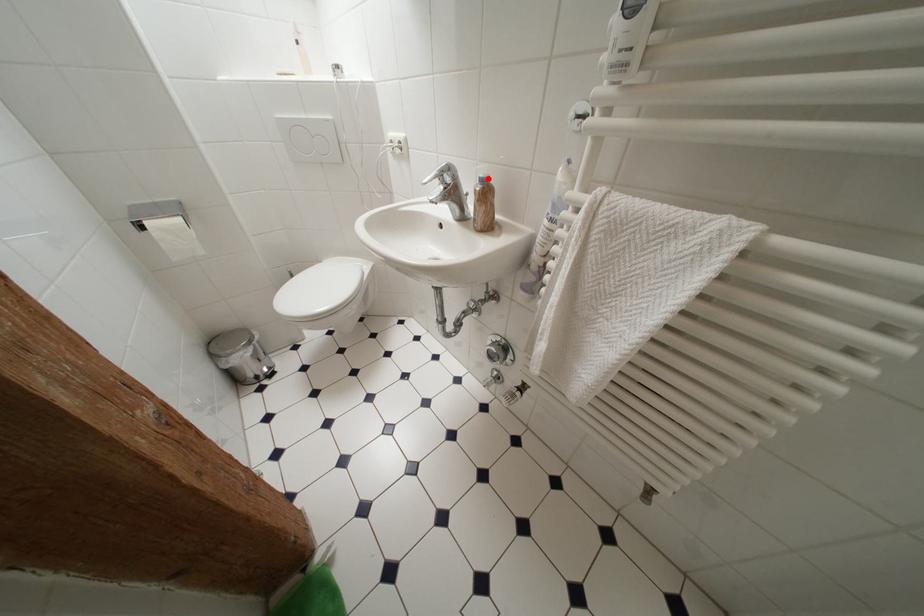
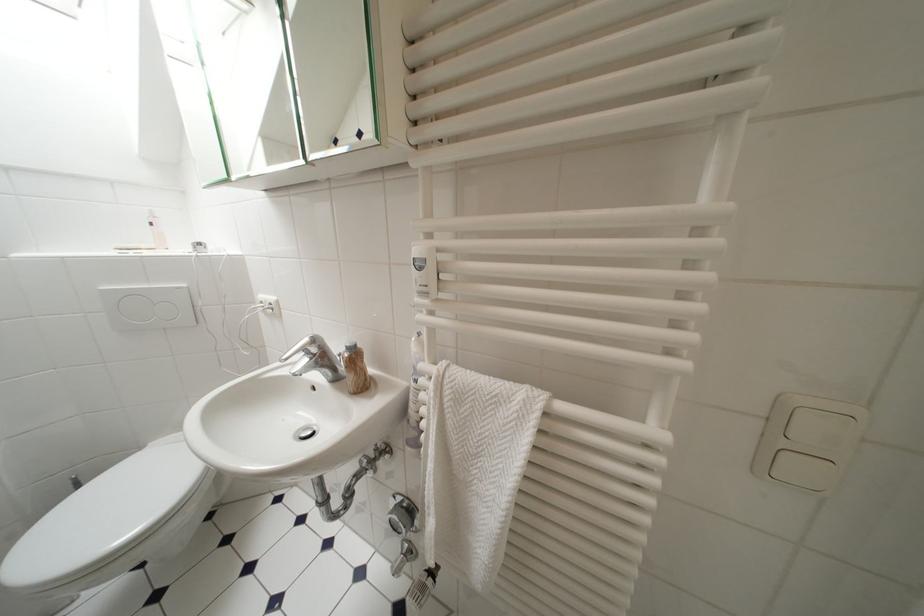
Where in the second image is the point corresponding to the highlighted location from the first image?

(355, 347)